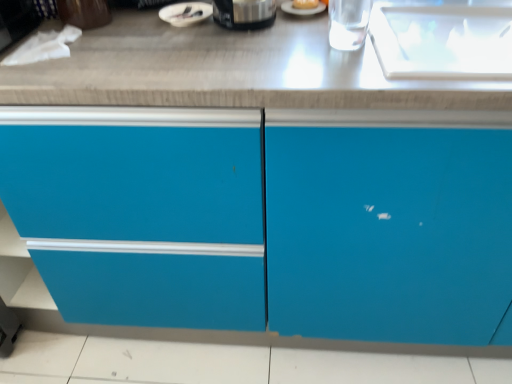
The height and width of the screenshot is (384, 512). In order to click on vacant region above matte blue cabinet at center (from a real-world perspective) in this screenshot , I will do `click(232, 33)`.